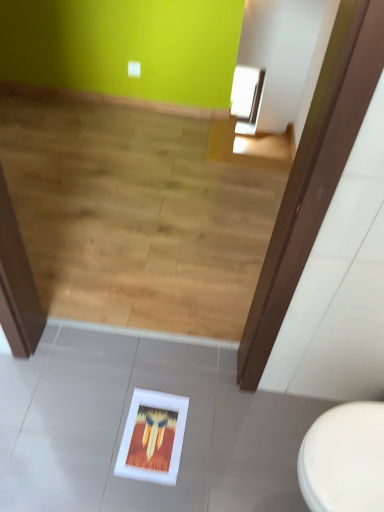
The image size is (384, 512). I want to click on blank space above white matte picture frame at lower center (from a real-world perspective), so click(153, 435).